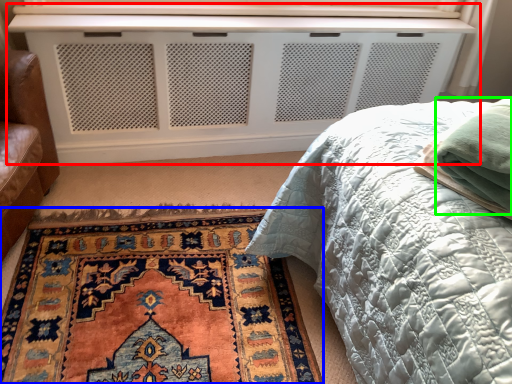
Question: Considering the real-world distances, which object is closest to vanity (highlighted by a red box)? mat (highlighted by a blue box) or material (highlighted by a green box).

Choices:
 (A) mat
 (B) material

Answer: (A)